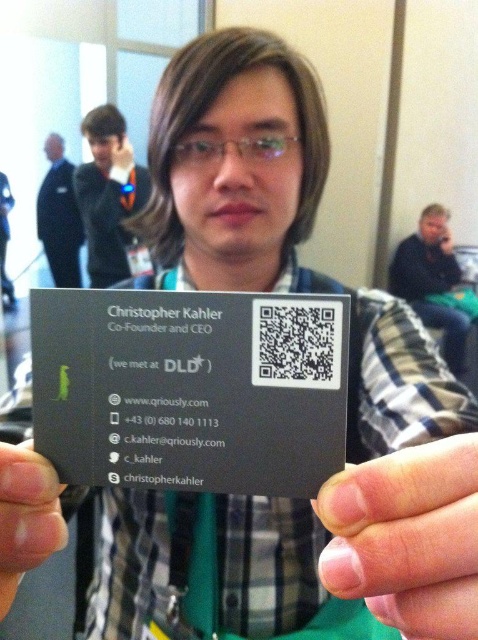
Looking at this image, who is taller, nail at center or dark blue suit at left?

With more height is dark blue suit at left.

The width and height of the screenshot is (478, 640). Describe the element at coordinates (406, 538) in the screenshot. I see `nail at center` at that location.

Between point (453, 468) and point (55, 204), which one is positioned in front?

Positioned in front is point (453, 468).

You are a GUI agent. You are given a task and a screenshot of the screen. Output one action in this format:
    pyautogui.click(x=<x>, y=<y>)
    Task: Click on the nail at center
    
    Given the screenshot: What is the action you would take?
    pyautogui.click(x=406, y=538)

Does black matte qr code at center come behind matte black jacket at upper left?

That is False.

Can you confirm if black matte qr code at center is wider than matte black jacket at upper left?

No, black matte qr code at center is not wider than matte black jacket at upper left.

Which is in front, point (323, 410) or point (126, 237)?

Point (323, 410) is in front.

Locate an element on the screen. This screenshot has width=478, height=640. black matte qr code at center is located at coordinates (191, 388).

Is point (422, 600) positioned in front of point (119, 160)?

That is True.

Is point (435, 545) positioned in front of point (113, 276)?

Yes, point (435, 545) is in front of point (113, 276).

Where is `nail at center`? nail at center is located at coordinates (406, 538).